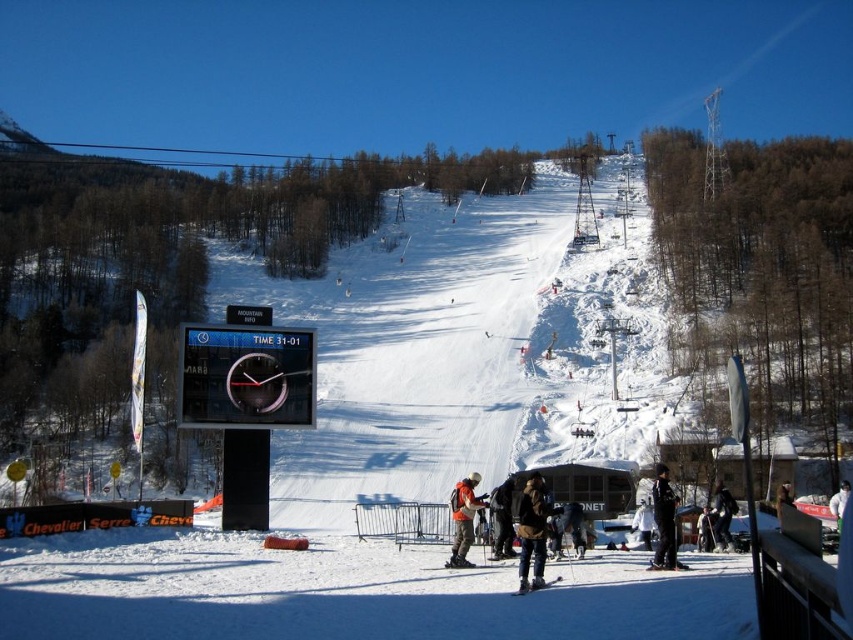
Can you confirm if dark brown leather jacket at lower center is positioned below white matte ski at center?

Yes, dark brown leather jacket at lower center is below white matte ski at center.

Which is more to the right, dark brown leather jacket at lower center or white matte ski at center?

From the viewer's perspective, white matte ski at center appears more on the right side.

The height and width of the screenshot is (640, 853). Find the location of `dark brown leather jacket at lower center`. dark brown leather jacket at lower center is located at coordinates (532, 531).

This screenshot has height=640, width=853. What are the coordinates of `black matte snowboarder at center` in the screenshot? It's located at (722, 516).

Based on the photo, is black matte snowboarder at center bigger than black matte ski at lower center?

Correct, black matte snowboarder at center is larger in size than black matte ski at lower center.

Is point (732, 513) positioned behind point (457, 564)?

Yes, point (732, 513) is behind point (457, 564).

Identify the location of black matte snowboarder at center. (722, 516).

Does orange fabric jacket at center have a larger size compared to black matte ski at lower center?

Yes.

Does orange fabric jacket at center appear on the right side of black matte ski at lower center?

Yes, orange fabric jacket at center is to the right of black matte ski at lower center.

Locate an element on the screen. The width and height of the screenshot is (853, 640). orange fabric jacket at center is located at coordinates (463, 518).